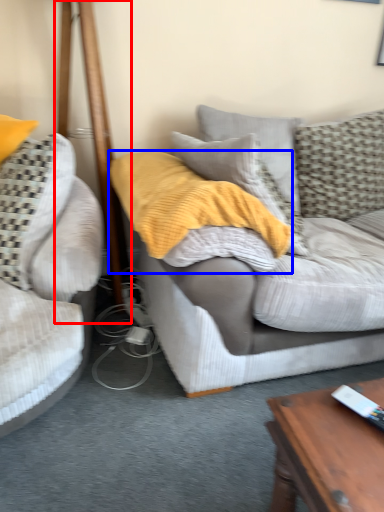
Question: Which object is closer to the camera taking this photo, pole (highlighted by a red box) or blanket (highlighted by a blue box)?

Choices:
 (A) pole
 (B) blanket

Answer: (B)